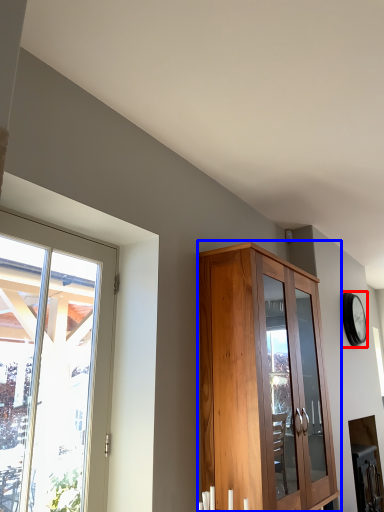
Question: Among these objects, which one is nearest to the camera, clock (highlighted by a red box) or cupboard (highlighted by a blue box)?

Choices:
 (A) clock
 (B) cupboard

Answer: (B)